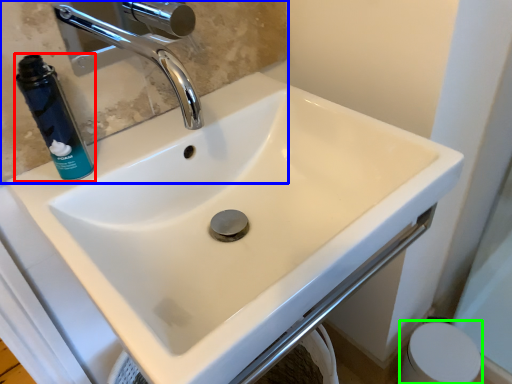
Question: Considering the real-world distances, which object is closest to mouthwash (highlighted by a red box)? mirror (highlighted by a blue box) or toilet paper (highlighted by a green box).

Choices:
 (A) mirror
 (B) toilet paper

Answer: (A)